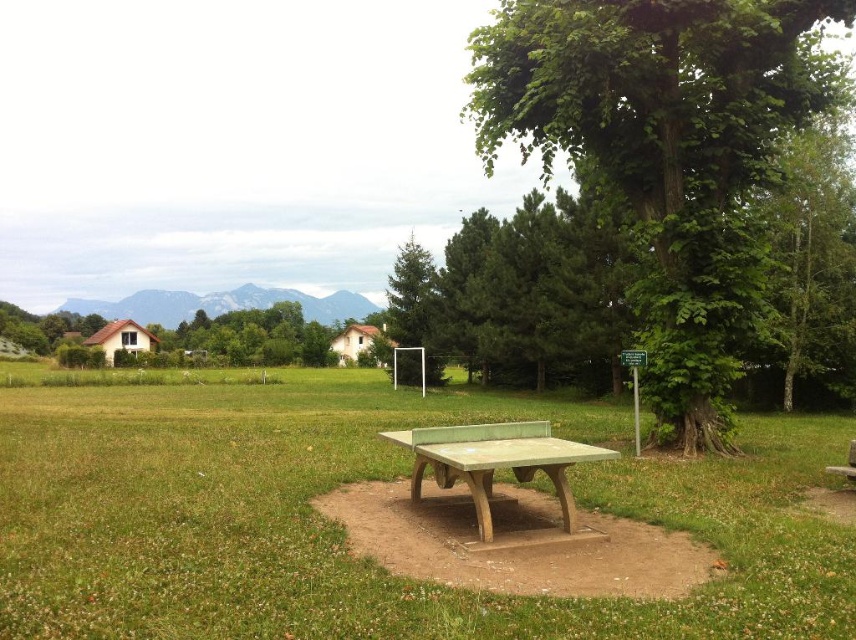
Question: Which object is the farthest from the green leafy tree at upper left?

Choices:
 (A) wooden park bench at lower right
 (B) green painted wood ping pong table at center
 (C) green matte tree at center
 (D) green leafy tree at center right

Answer: (A)

Question: In this image, where is green grass at center located relative to green leafy tree at center?

Choices:
 (A) left
 (B) right

Answer: (B)

Question: Observing the image, what is the correct spatial positioning of green painted wood ping pong table at center in reference to green matte tree at center?

Choices:
 (A) right
 (B) left

Answer: (A)

Question: Which point is closer to the camera taking this photo?

Choices:
 (A) (765, 497)
 (B) (395, 288)
 (C) (506, 464)

Answer: (C)

Question: Does green leafy tree at center lie in front of green leafy tree at upper left?

Choices:
 (A) yes
 (B) no

Answer: (A)

Question: Which point appears closest to the camera in this image?

Choices:
 (A) (438, 458)
 (B) (845, 540)
 (C) (843, 467)

Answer: (A)